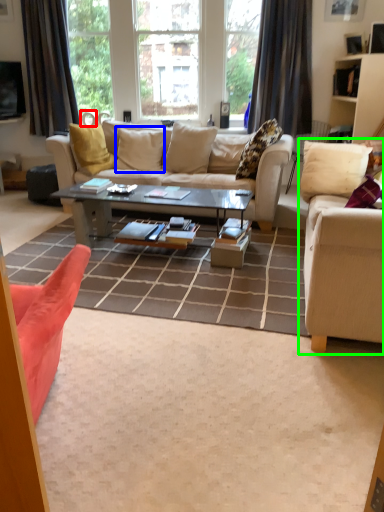
Question: Which object is the farthest from armchair (highlighted by a red box)? Choose among these: pillow (highlighted by a blue box) or studio couch (highlighted by a green box).

Choices:
 (A) pillow
 (B) studio couch

Answer: (B)